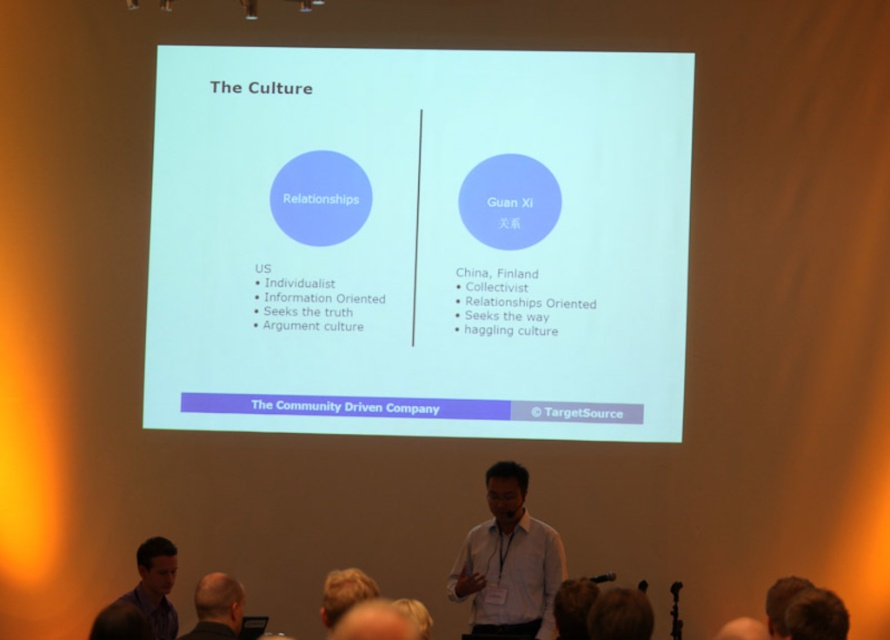
Is white matte projector screen at center closer to camera compared to dark gray hair at lower center?

No, it is behind dark gray hair at lower center.

Is white matte projector screen at center positioned behind dark gray hair at lower center?

Yes.

Where is `white matte projector screen at center`? The image size is (890, 640). white matte projector screen at center is located at coordinates (418, 243).

Does dark gray hair at lower center have a lesser height compared to blonde hair at upper center?

Incorrect, dark gray hair at lower center's height does not fall short of blonde hair at upper center's.

Who is positioned more to the left, dark gray hair at lower center or blonde hair at upper center?

dark gray hair at lower center is more to the left.

Does point (208, 628) come behind point (356, 577)?

No, it is not.

Where is `dark gray hair at lower center`? dark gray hair at lower center is located at coordinates (216, 608).

Is point (140, 573) in front of point (328, 600)?

No, it is not.

Does matte black shirt at lower left appear over blonde hair at upper center?

No, matte black shirt at lower left is not above blonde hair at upper center.

Is point (159, 557) positioned after point (353, 579)?

Yes.

Find the location of a particular element. matte black shirt at lower left is located at coordinates click(155, 586).